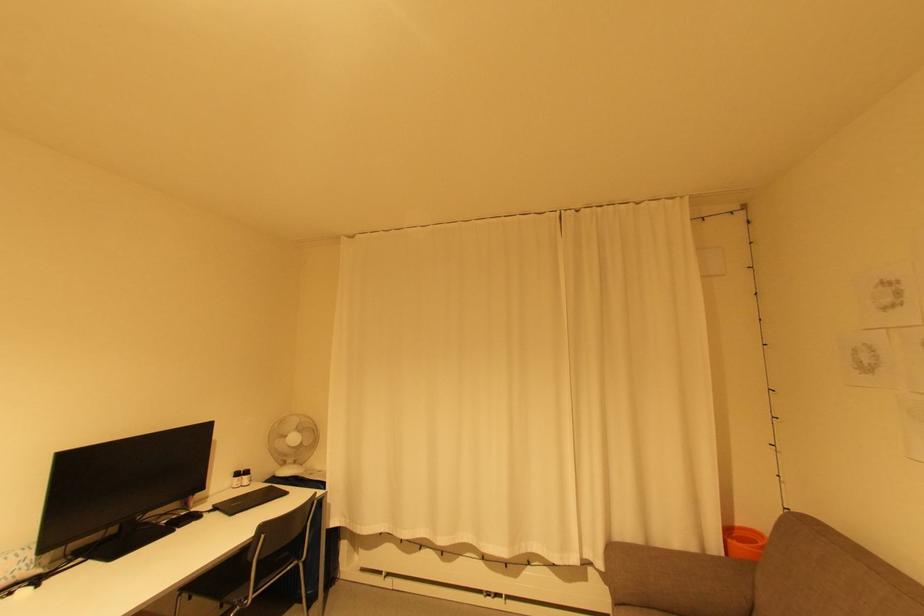
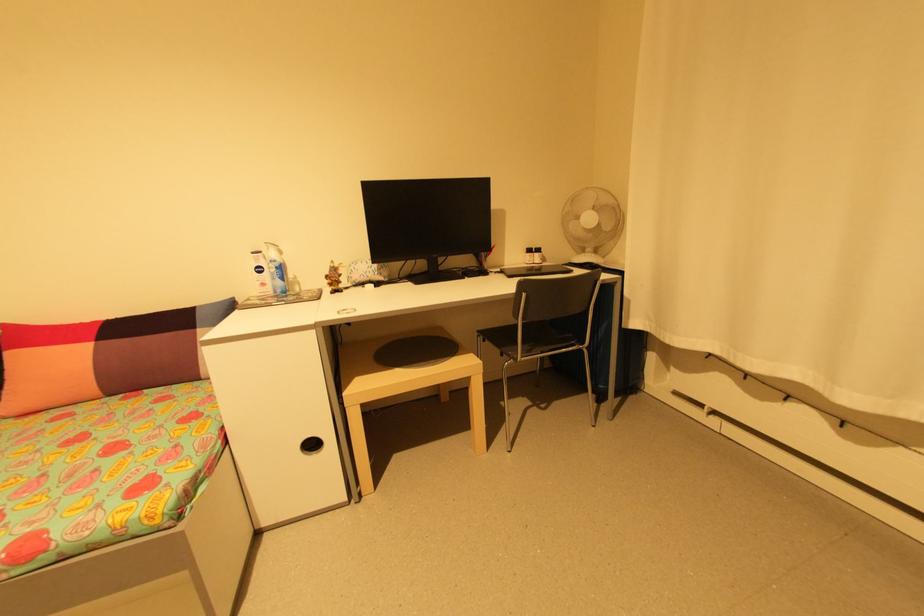
Where in the second image is the point corresponding to [250,477] from the first image?

(541, 254)